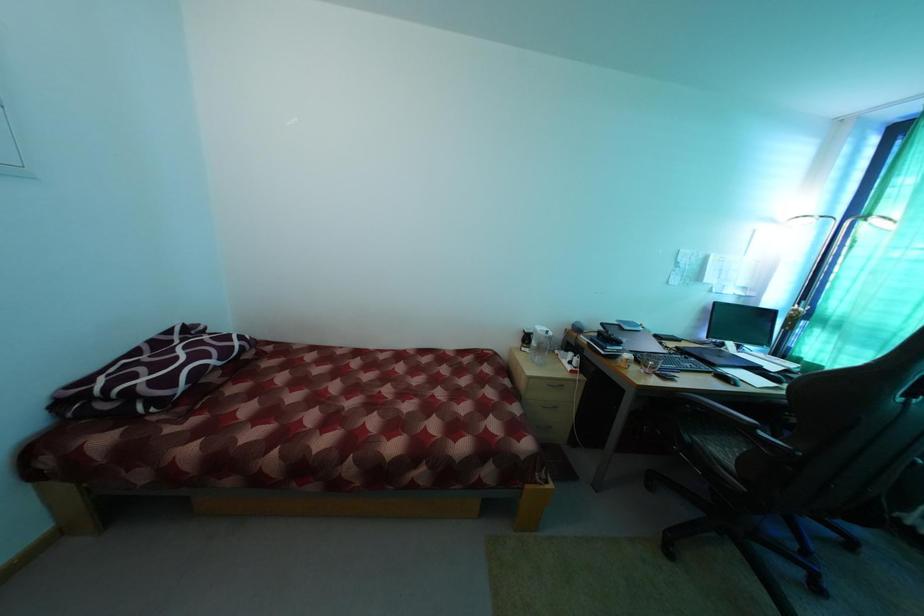
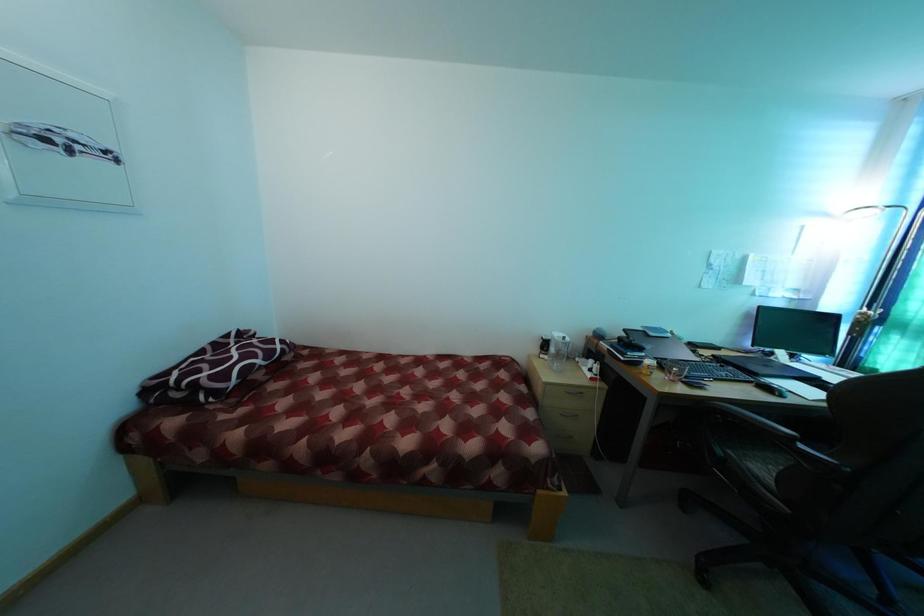
Question: The camera is either moving clockwise (left) or counter-clockwise (right) around the object. The first image is from the beginning of the video and the second image is from the end. Is the camera moving left or right when shooting the video?

Choices:
 (A) Left
 (B) Right

Answer: (B)